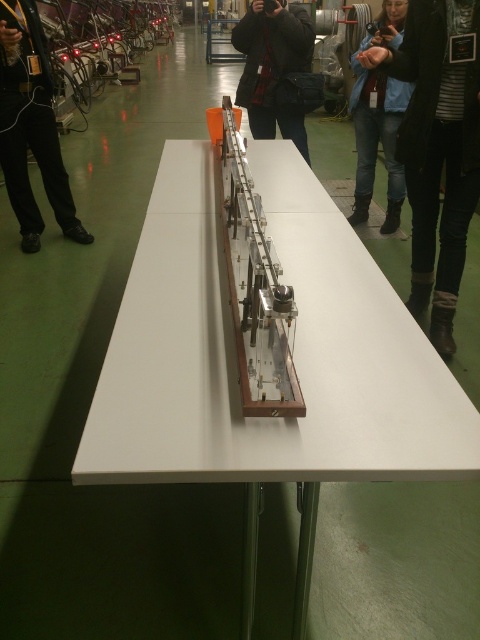
Does black leather pants at left lie in front of blue jeans at center?

Yes, it is in front of blue jeans at center.

Does black leather pants at left appear on the left side of blue jeans at center?

Correct, you'll find black leather pants at left to the left of blue jeans at center.

Is point (63, 221) closer to camera compared to point (372, 104)?

That is False.

The width and height of the screenshot is (480, 640). In order to click on black leather pants at left in this screenshot , I will do `click(31, 125)`.

Which is above, white glossy table at center or black leather pants at left?

black leather pants at left

Does white glossy table at center have a greater width compared to black leather pants at left?

Yes.

Who is more distant from viewer, (475,451) or (8,164)?

Point (8,164)

This screenshot has height=640, width=480. In order to click on white glossy table at center in this screenshot , I will do `click(294, 356)`.

Does black leather jacket at center have a lesser width compared to blue jeans at center?

No.

Is point (237, 90) farther from camera compared to point (394, 156)?

Yes.

Does point (264, 49) come farther from viewer compared to point (356, 145)?

That is False.

This screenshot has height=640, width=480. In order to click on black leather jacket at center in this screenshot , I will do `click(273, 67)`.